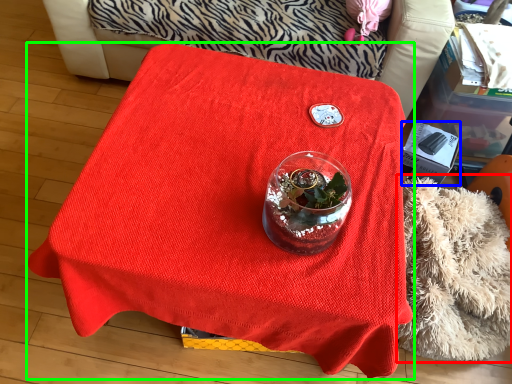
Question: Which object is positioned closest to blanket (highlighted by a red box)? Select from box (highlighted by a blue box) and table (highlighted by a green box).

Choices:
 (A) box
 (B) table

Answer: (A)